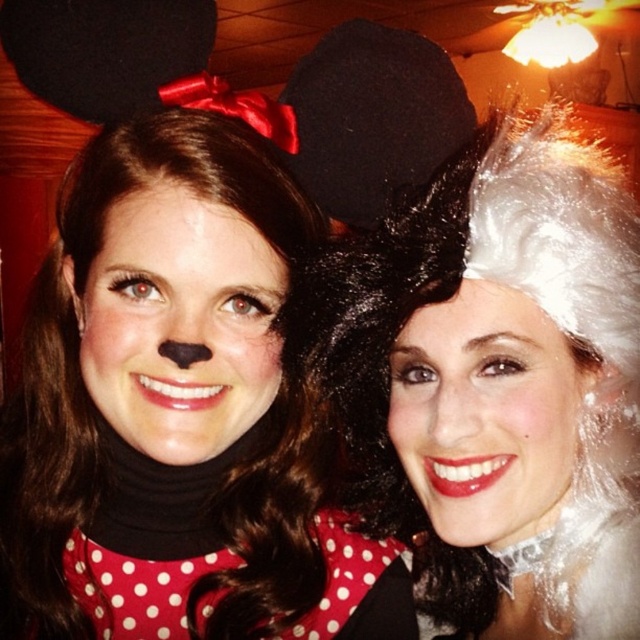
You are standing in the room where the two people are posing for a photo. You want to place a small decoration between the two points marked as point (x=252, y=486) and point (x=620, y=218). Based on their positions, will the decoration be closer to the front or the back of the scene?

The decoration will be closer to the back of the scene because point (x=252, y=486) is behind point (x=620, y=218), so the midpoint between them would still be closer to the back.

In the scene shown: You are standing in front of the two people in the image. There is a point at coordinates point (177, 412). Which object in the image does this point belong to?

The point (177, 412) is on the matte black mouse ears at left.

You are a photographer setting up for a group photo. You need to ensure that the matte black mouse ears at left and the white shiny wig at upper right are not overlapping in the final shot. Based on their current positions, what is the minimum distance you should keep between them to prevent overlap?

The minimum distance between the matte black mouse ears at left and the white shiny wig at upper right should be at least 5.26 inches to prevent overlap, as they are currently positioned 5.26 inches apart.